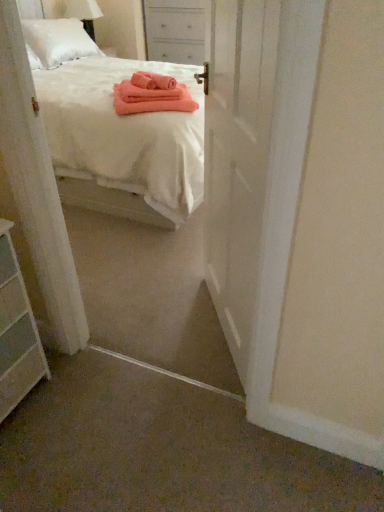
Describe the element at coordinates (16, 331) in the screenshot. I see `white matte chest of drawers at lower left` at that location.

What do you see at coordinates (175, 30) in the screenshot?
I see `white painted wood nightstand at upper center` at bounding box center [175, 30].

In order to click on white matte chest of drawers at lower left in this screenshot , I will do `click(16, 331)`.

From the picture: From the image's perspective, is white glossy door at center beneath white painted wood nightstand at upper center?

Yes.

From a real-world perspective, does white glossy door at center sit lower than white painted wood nightstand at upper center?

Yes, from a real-world perspective, white glossy door at center is beneath white painted wood nightstand at upper center.

Which object is more forward, white glossy door at center or white painted wood nightstand at upper center?

white glossy door at center is more forward.

Considering the sizes of objects white glossy door at center and white painted wood nightstand at upper center in the image provided, who is smaller, white glossy door at center or white painted wood nightstand at upper center?

white glossy door at center.

Does point (201, 11) come farther from viewer compared to point (14, 376)?

Yes, point (201, 11) is behind point (14, 376).

Is white painted wood nightstand at upper center positioned with its back to white matte chest of drawers at lower left?

No, white painted wood nightstand at upper center's orientation is not away from white matte chest of drawers at lower left.

Is white painted wood nightstand at upper center spatially inside white matte chest of drawers at lower left, or outside of it?

The correct answer is: outside.

Is white painted wood nightstand at upper center directly adjacent to white matte chest of drawers at lower left?

No, white painted wood nightstand at upper center is not touching white matte chest of drawers at lower left.

Could you tell me if white matte chest of drawers at lower left is facing white painted wood nightstand at upper center?

No, white matte chest of drawers at lower left is not facing towards white painted wood nightstand at upper center.

Which is further, (13, 390) or (186, 41)?

Point (186, 41)

From the image's perspective, relative to white painted wood nightstand at upper center, is white matte chest of drawers at lower left above or below?

From the image's perspective, white matte chest of drawers at lower left appears below white painted wood nightstand at upper center.

Is white cotton bed at center smaller than white glossy door at center?

No, white cotton bed at center is not smaller than white glossy door at center.

Is white cotton bed at center situated inside white glossy door at center or outside?

white cotton bed at center is spatially situated outside white glossy door at center.

From a real-world perspective, who is located lower, white cotton bed at center or white glossy door at center?

white cotton bed at center, from a real-world perspective.

From the image's perspective, who appears lower, white cotton bed at center or white glossy door at center?

white glossy door at center appears lower in the image.

Which of these two, white matte chest of drawers at lower left or white glossy door at center, stands shorter?

white matte chest of drawers at lower left.

Can you confirm if white matte chest of drawers at lower left is positioned to the left of white glossy door at center?

Yes, white matte chest of drawers at lower left is to the left of white glossy door at center.

How much distance is there between white matte chest of drawers at lower left and white glossy door at center?

The distance of white matte chest of drawers at lower left from white glossy door at center is 31.02 inches.

Is white matte chest of drawers at lower left positioned far away from white glossy door at center?

No, there isn't a large distance between white matte chest of drawers at lower left and white glossy door at center.

Would you say white cotton bed at center is inside or outside white matte chest of drawers at lower left?

white cotton bed at center is located beyond the bounds of white matte chest of drawers at lower left.

Is white cotton bed at center taller than white matte chest of drawers at lower left?

Yes, white cotton bed at center is taller than white matte chest of drawers at lower left.

Is white cotton bed at center thinner than white matte chest of drawers at lower left?

No, white cotton bed at center is not thinner than white matte chest of drawers at lower left.

Does white glossy door at center touch white matte chest of drawers at lower left?

They are not placed beside each other.

Does point (270, 67) come farther from viewer compared to point (5, 233)?

That is False.

Can you confirm if white glossy door at center is thinner than white matte chest of drawers at lower left?

Yes, white glossy door at center is thinner than white matte chest of drawers at lower left.

Considering the relative sizes of white glossy door at center and white matte chest of drawers at lower left in the image provided, is white glossy door at center taller than white matte chest of drawers at lower left?

Yes, white glossy door at center is taller than white matte chest of drawers at lower left.

Identify the location of nightstand that is behind the white glossy door at center. (175, 30).

What are the coordinates of `the chest of drawers that is in front of the white painted wood nightstand at upper center` in the screenshot? It's located at (16, 331).

Looking at the image, which one is located further to white matte chest of drawers at lower left, white cotton bed at center or white glossy door at center?

Among the two, white cotton bed at center is located further to white matte chest of drawers at lower left.

Estimate the real-world distances between objects in this image. Which object is closer to white matte chest of drawers at lower left, white painted wood nightstand at upper center or white cotton bed at center?

white cotton bed at center.

Based on their spatial positions, is white cotton bed at center or white matte chest of drawers at lower left closer to white glossy door at center?

The object closer to white glossy door at center is white matte chest of drawers at lower left.

Looking at the image, which one is located further to white glossy door at center, white painted wood nightstand at upper center or white cotton bed at center?

Based on the image, white painted wood nightstand at upper center appears to be further to white glossy door at center.

Based on their spatial positions, is white cotton bed at center or white matte chest of drawers at lower left closer to white painted wood nightstand at upper center?

Among the two, white cotton bed at center is located nearer to white painted wood nightstand at upper center.

Based on their spatial positions, is white matte chest of drawers at lower left or white painted wood nightstand at upper center closer to white cotton bed at center?

white painted wood nightstand at upper center is closer to white cotton bed at center.

Which object lies nearer to the anchor point white matte chest of drawers at lower left, white cotton bed at center or white painted wood nightstand at upper center?

The object closer to white matte chest of drawers at lower left is white cotton bed at center.

Based on their spatial positions, is white cotton bed at center or white glossy door at center further from white painted wood nightstand at upper center?

white glossy door at center is positioned further to the anchor white painted wood nightstand at upper center.

At what (x,y) coordinates should I click in order to perform the action: click on bed positioned between white glossy door at center and white painted wood nightstand at upper center from near to far. Please return your answer as a coordinate pair (x, y). Looking at the image, I should click on (114, 123).

Locate an element on the screen. the chest of drawers located between white glossy door at center and white painted wood nightstand at upper center in the depth direction is located at coordinates (16, 331).

Find the location of a particular element. The width and height of the screenshot is (384, 512). bed between white matte chest of drawers at lower left and white painted wood nightstand at upper center in the front-back direction is located at coordinates (114, 123).

Locate an element on the screen. This screenshot has height=512, width=384. door between white cotton bed at center and white matte chest of drawers at lower left from top to bottom is located at coordinates (237, 157).